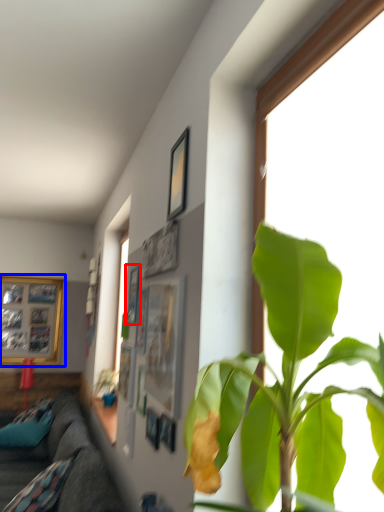
Question: Which object appears farthest to the camera in this image, picture frame (highlighted by a red box) or picture frame (highlighted by a blue box)?

Choices:
 (A) picture frame
 (B) picture frame

Answer: (B)